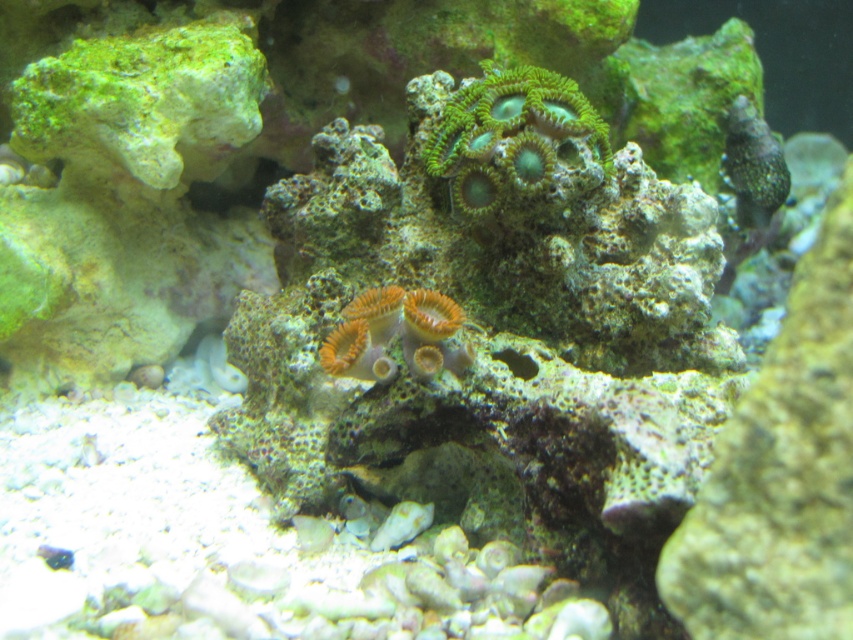
You are a marine biologist using a camera to document underwater life. You want to capture a closeup shot of the green coral at upper center. Based on the scene description, can you determine if you are within the recommended 1 meter distance for optimal clarity?

The green coral at upper center and camera are 1.16 meters apart from each other, which is slightly beyond the recommended 1 meter distance for optimal clarity. You may need to move closer to achieve the best shot.

You are a marine biologist observing the underwater scene. You notice two points marked in the image. The first point is at coordinate point (457, 184) and the second is at point (416, 352). From your vantage point, which point is closer to you?

Point (416, 352) is closer to you because point (457, 184) is behind it.